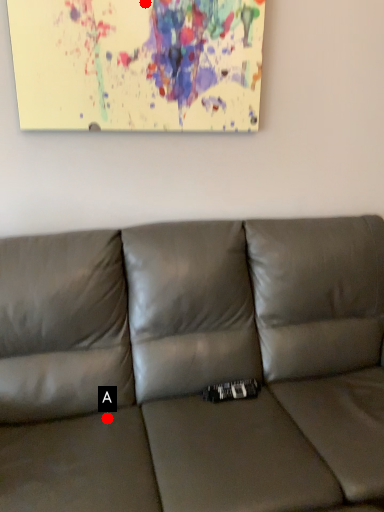
Question: Two points are circled on the image, labeled by A and B beside each circle. Which of the following is the closest to the observer?

Choices:
 (A) A is closer
 (B) B is closer

Answer: (A)